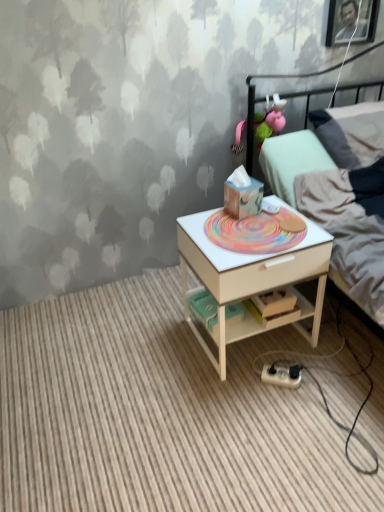
Where is `free spot to the right of white plastic power strip at lower center`? This screenshot has height=512, width=384. free spot to the right of white plastic power strip at lower center is located at coordinates (324, 377).